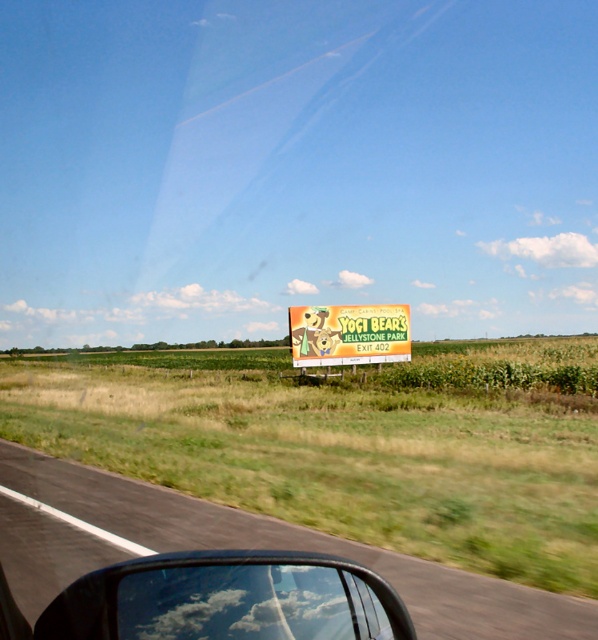
You are a passenger in a car and want to read the text on the yellow cardboard sign at center. Can you see the entire text through the transparent glass car window at lower center?

The transparent glass car window at lower center has a lesser width compared to yellow cardboard sign at center, so the entire text may not be visible through the window.

You are a passenger in the car and want to read the text on the yellow cardboard sign at center. Can you see it clearly through the transparent glass car window at lower center?

The transparent glass car window at lower center is closer to the viewer than the yellow cardboard sign at center, so the window may block your view of the sign, making it difficult to read clearly.

Consider the image. You are a delivery driver who needs to check the distance between the black asphalt road at center and the transparent glass car window at lower center to ensure your package won

The black asphalt road at center and transparent glass car window at lower center are 1.60 meters apart, so the package can be safely placed there as the distance is sufficient.